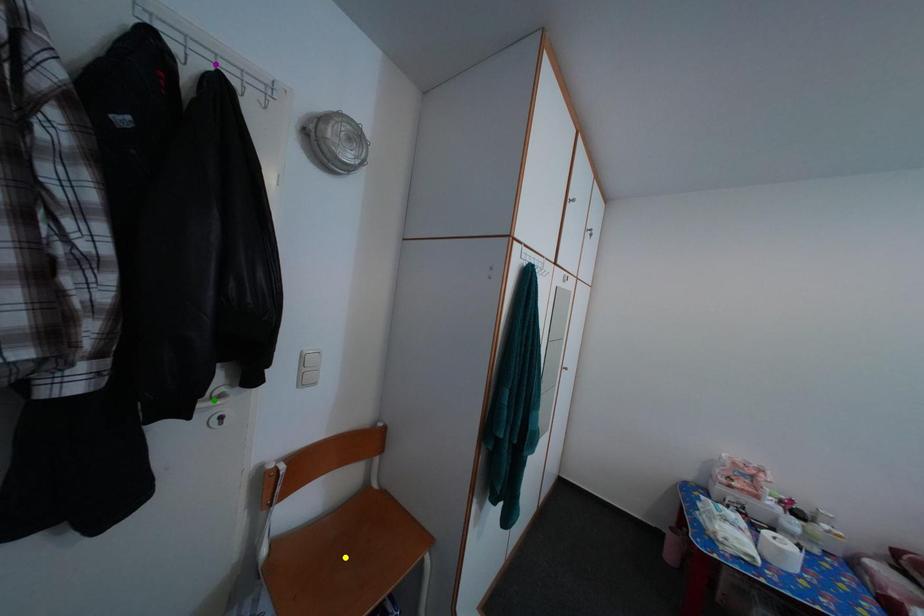
Order these from nearest to farthest:
A) purple point
B) green point
C) yellow point

yellow point < green point < purple point